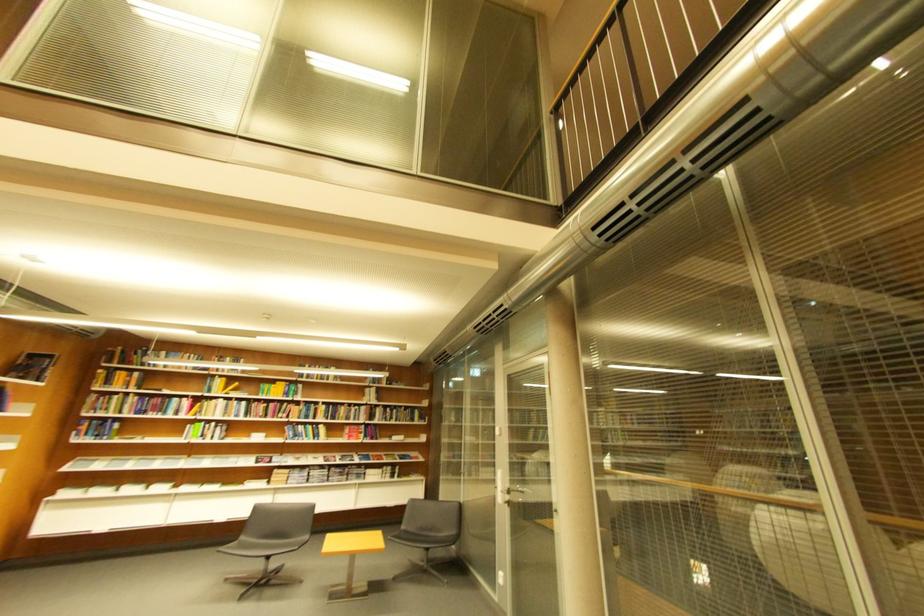
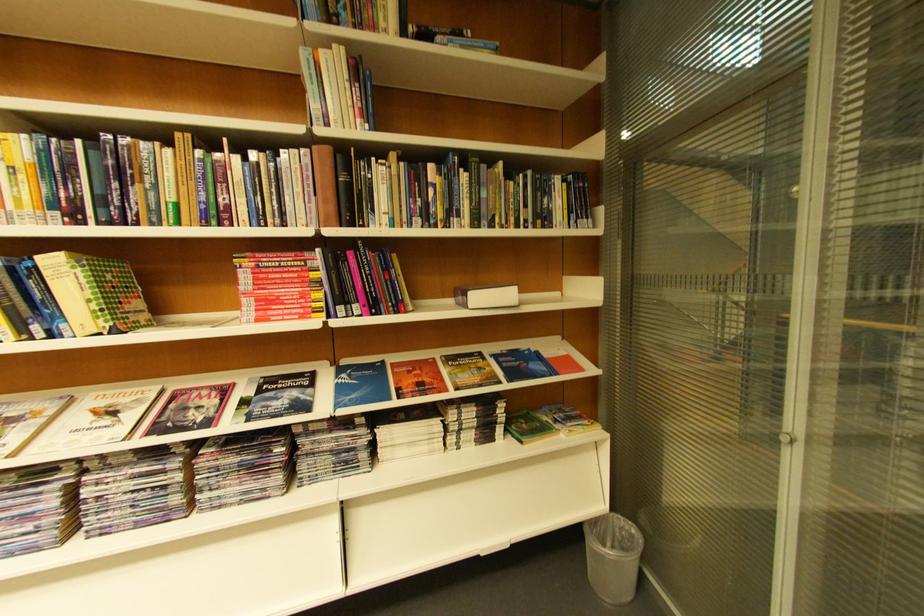
The point at (379, 440) is marked in the first image. Where is the corresponding point in the second image?

(367, 310)